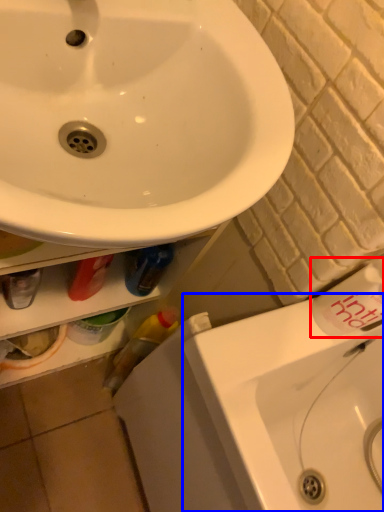
Question: Among these objects, which one is nearest to the camera, toiletry (highlighted by a red box) or counter top (highlighted by a blue box)?

Choices:
 (A) toiletry
 (B) counter top

Answer: (B)